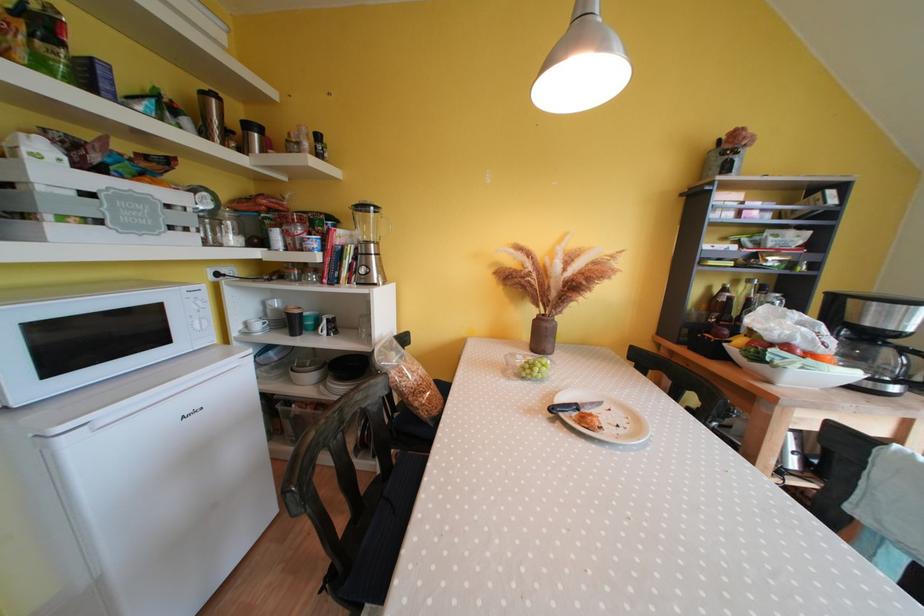
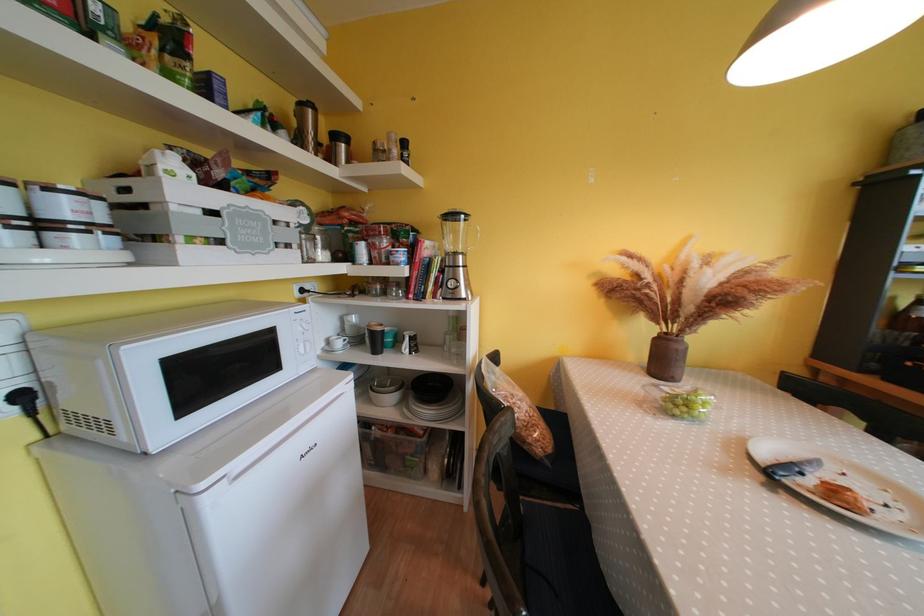
Question: How did the camera likely rotate?

Choices:
 (A) Left
 (B) Right
 (C) Up
 (D) Down

Answer: (A)